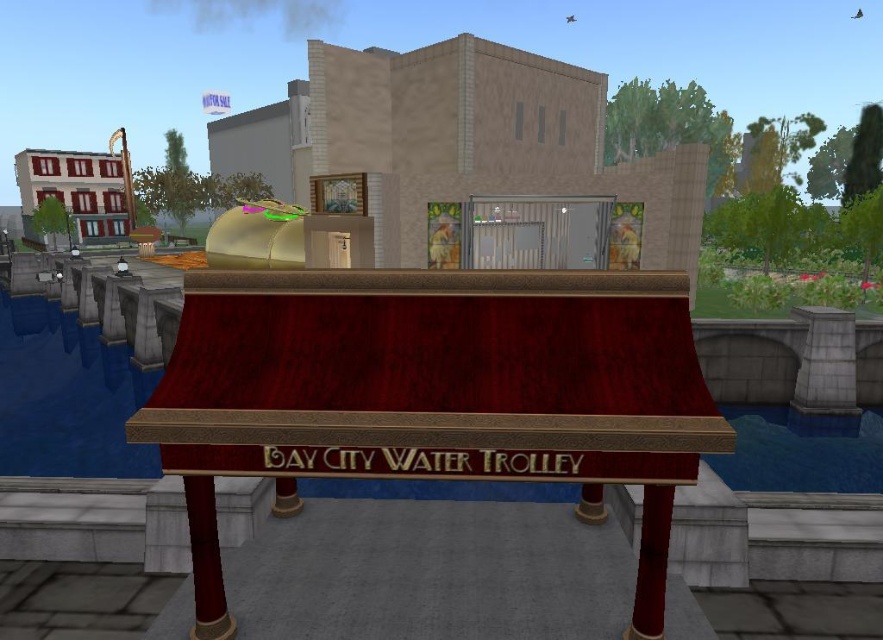
Between blue water at lower right and smooth red wood pillar at lower center, which one appears on the left side from the viewer's perspective?

Positioned to the left is smooth red wood pillar at lower center.

Is blue water at lower right shorter than smooth red wood pillar at lower center?

No, blue water at lower right is not shorter than smooth red wood pillar at lower center.

The width and height of the screenshot is (883, 640). Identify the location of blue water at lower right. (801, 451).

Image resolution: width=883 pixels, height=640 pixels. What are the coordinates of `blue water at lower right` in the screenshot? It's located at (801, 451).

What do you see at coordinates (826, 362) in the screenshot?
I see `gray stone pillar at right` at bounding box center [826, 362].

Who is more forward, [798,392] or [647,572]?

Point [647,572] is more forward.

This screenshot has height=640, width=883. Identify the location of gray stone pillar at right. (826, 362).

Which of these two, blue water at lower right or gray stone pillar at right, stands taller?

gray stone pillar at right is taller.

Can you confirm if blue water at lower right is positioned below gray stone pillar at right?

Correct, blue water at lower right is located below gray stone pillar at right.

Between point (745, 476) and point (806, 378), which one is positioned behind?

Point (806, 378)

Where is `blue water at lower right`? The image size is (883, 640). blue water at lower right is located at coordinates (801, 451).